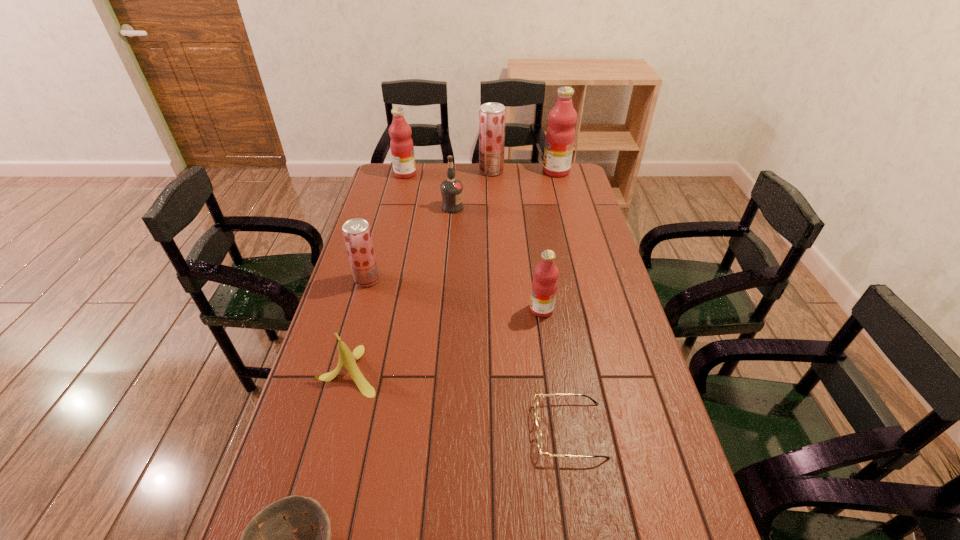
I want to click on fruit juice that is at the right edge, so click(560, 135).

Locate an element on the screen. The width and height of the screenshot is (960, 540). spectacles present at the right edge is located at coordinates (539, 431).

Locate an element on the screen. The width and height of the screenshot is (960, 540). object that is at the far left corner is located at coordinates (402, 149).

Identify the location of object that is at the far right corner. (560, 135).

Locate an element on the screen. The height and width of the screenshot is (540, 960). vacant space at the far edge of the desktop is located at coordinates coord(474,166).

I want to click on free location at the left edge, so click(x=372, y=202).

Identify the location of free space at the right edge of the desktop. (552, 205).

Identify the location of vacant space at the far left corner of the desktop. (381, 183).

Where is `vacant space at the far right corner`? Image resolution: width=960 pixels, height=540 pixels. vacant space at the far right corner is located at coordinates (577, 168).

Where is `vacant space that's between the seventh tallest object and the rightmost fruit juice`? vacant space that's between the seventh tallest object and the rightmost fruit juice is located at coordinates (452, 271).